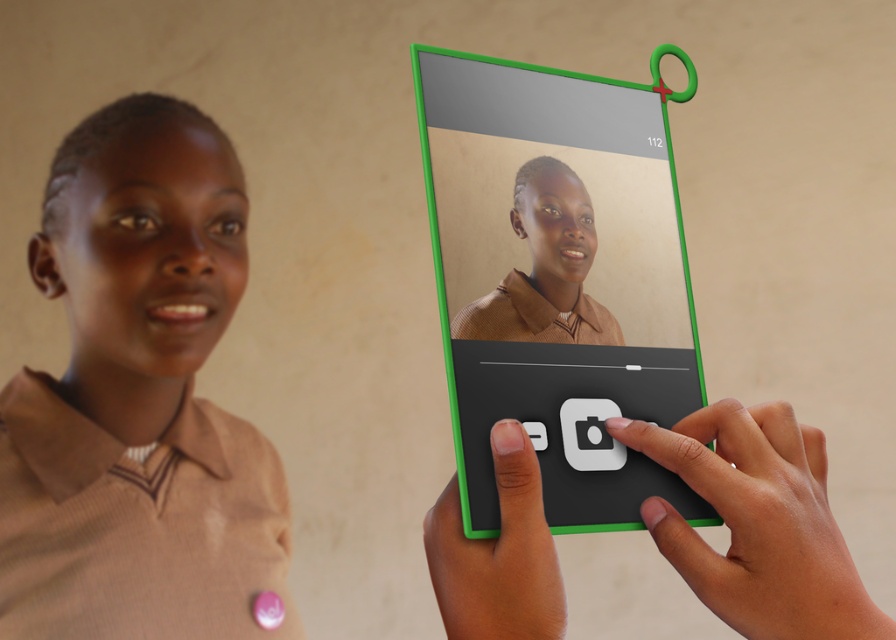
Can you confirm if matte brown sweater at center is bigger than black matte phone at center?

Indeed, matte brown sweater at center has a larger size compared to black matte phone at center.

I want to click on matte brown sweater at center, so click(x=138, y=401).

Is point (9, 419) farther from camera compared to point (442, 616)?

Yes, it is behind point (442, 616).

Identify the location of matte brown sweater at center. The width and height of the screenshot is (896, 640). (138, 401).

Is point (151, 371) in front of point (588, 317)?

No.

In the scene shown: Can you confirm if matte brown sweater at center is bigger than green plastic tablet at center?

Yes.

Is point (123, 180) more distant than point (582, 358)?

Yes, point (123, 180) is behind point (582, 358).

This screenshot has height=640, width=896. What are the coordinates of `matte brown sweater at center` in the screenshot? It's located at (138, 401).

Is matte black touchpad at center wider than black matte phone at center?

Yes.

Which is more to the right, matte black touchpad at center or black matte phone at center?

Positioned to the right is matte black touchpad at center.

Identify the location of matte black touchpad at center. (757, 522).